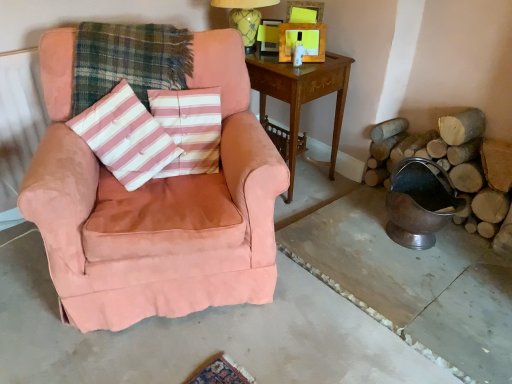
Locate an element on the screen. Image resolution: width=512 pixels, height=384 pixels. vacant space to the left of polished silver swivel chair at lower right is located at coordinates (351, 234).